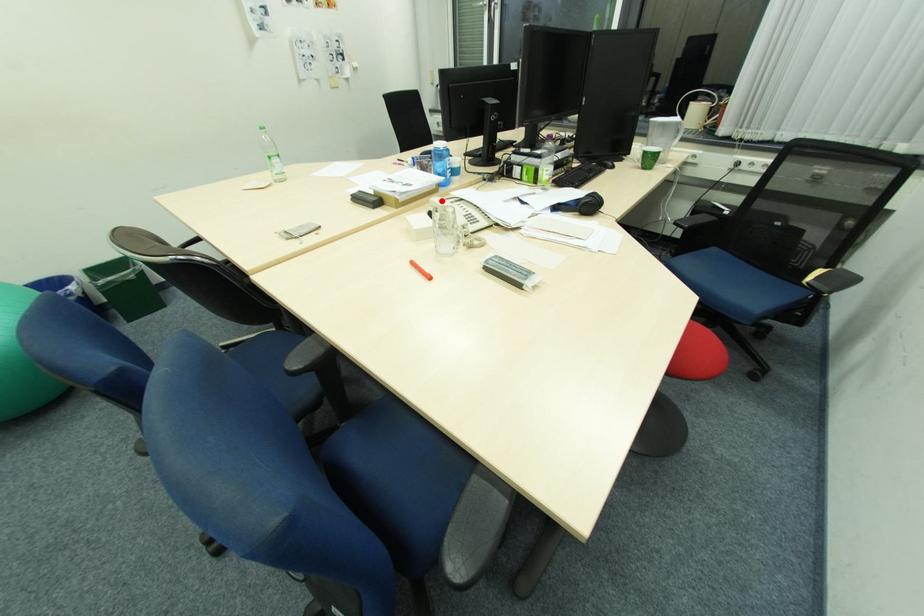
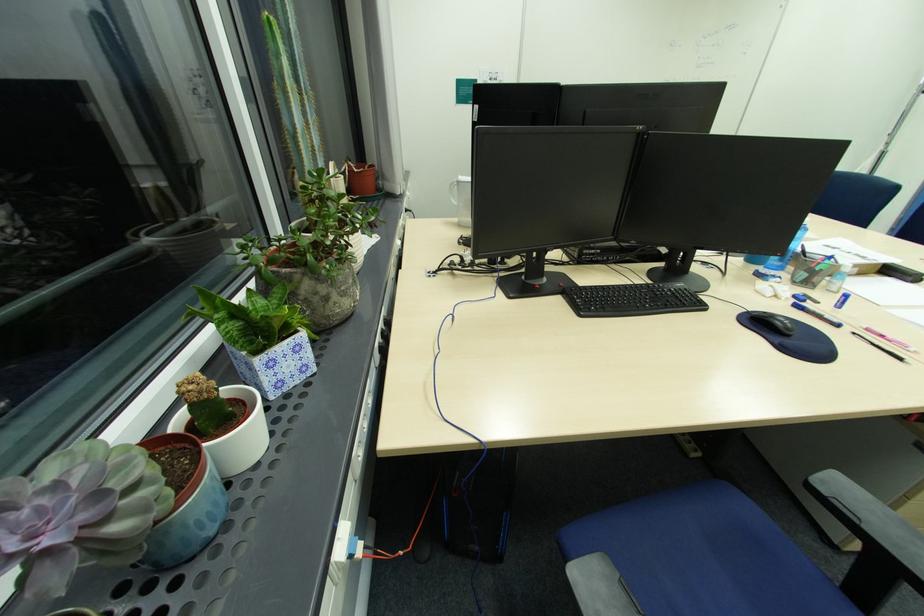
Question: I am providing you with two images of the same scene from different viewpoints. A red point is marked on the first image. Can you still see the location of the red point in image 2?

Choices:
 (A) Yes
 (B) No

Answer: (B)